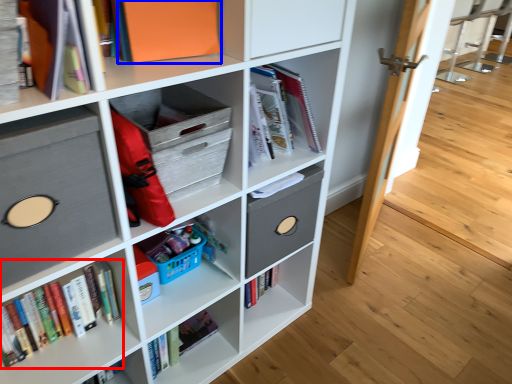
Question: Which object is further to the camera taking this photo, book (highlighted by a red box) or paperback book (highlighted by a blue box)?

Choices:
 (A) book
 (B) paperback book

Answer: (A)